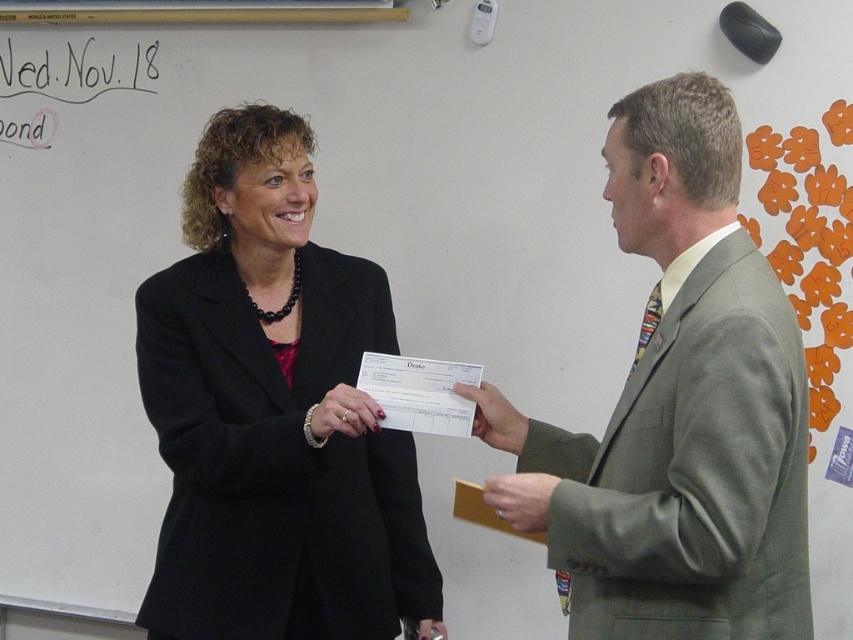
Question: Can you confirm if black matte blazer at center is positioned below white paper at center?

Choices:
 (A) no
 (B) yes

Answer: (A)

Question: Estimate the real-world distances between objects in this image. Which object is farther from the matte black check at center?

Choices:
 (A) black matte blazer at center
 (B) white paper at center

Answer: (A)

Question: Which point is farther to the camera?

Choices:
 (A) light gray suit at center
 (B) matte black check at center

Answer: (B)

Question: Estimate the real-world distances between objects in this image. Which object is farther from the matte black check at center?

Choices:
 (A) matte gray suit at right
 (B) black matte blazer at center
 (C) light gray suit at center
 (D) white paper at center

Answer: (C)

Question: Does matte gray suit at right lie behind matte black check at center?

Choices:
 (A) no
 (B) yes

Answer: (A)

Question: Where is light gray suit at center located in relation to matte black check at center in the image?

Choices:
 (A) above
 (B) below

Answer: (A)